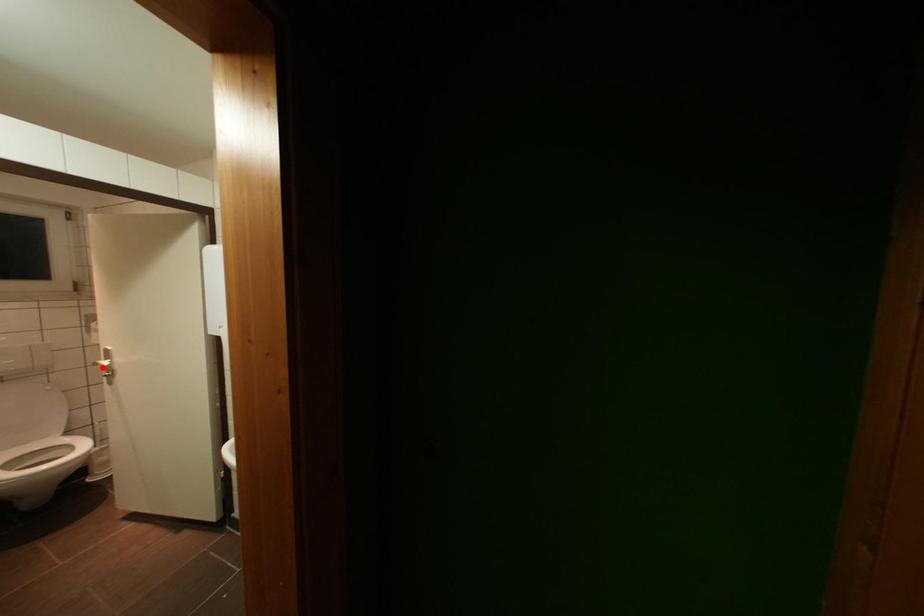
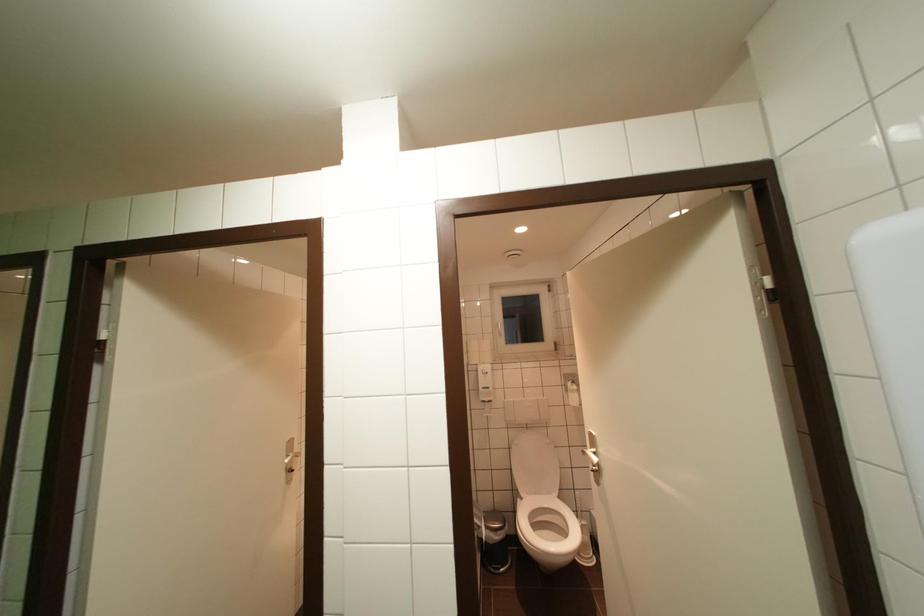
Locate, in the second image, the point that corresponds to the highlighted location in the first image.

(591, 456)